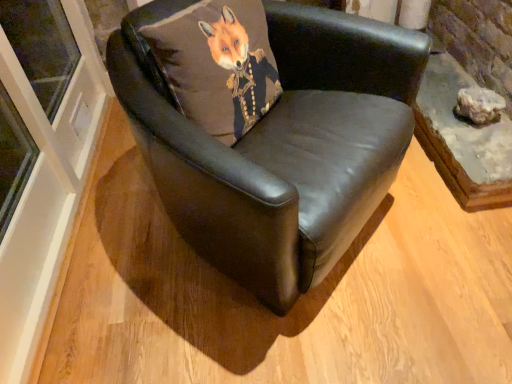
You are a GUI agent. You are given a task and a screenshot of the screen. Output one action in this format:
    pyautogui.click(x=<x>, y=<y>)
    Task: Click on the vacant space behind matte gray rock at right
    
    Given the screenshot: What is the action you would take?
    pyautogui.click(x=450, y=94)